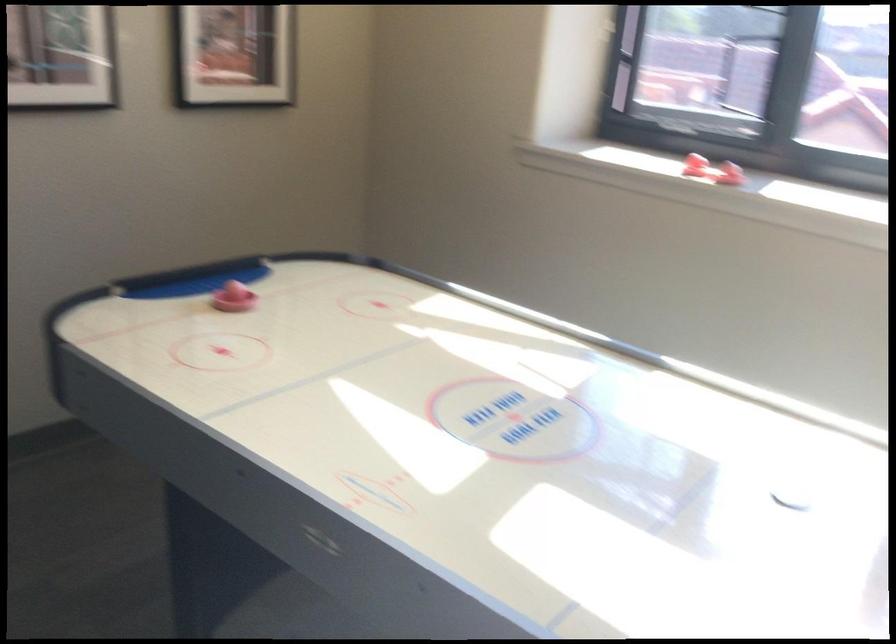
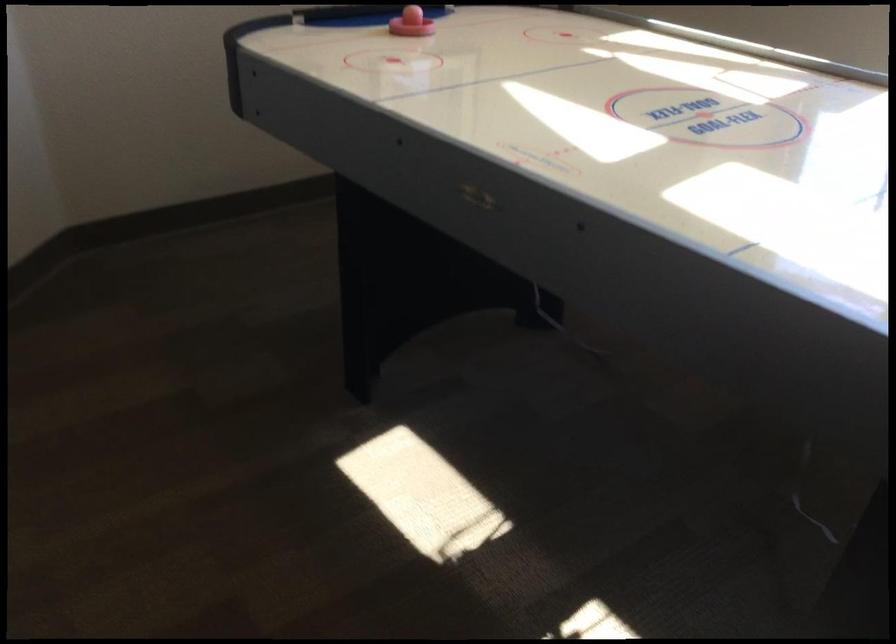
Question: The camera is either moving clockwise (left) or counter-clockwise (right) around the object. The first image is from the beginning of the video and the second image is from the end. Is the camera moving left or right when shooting the video?

Choices:
 (A) Left
 (B) Right

Answer: (B)